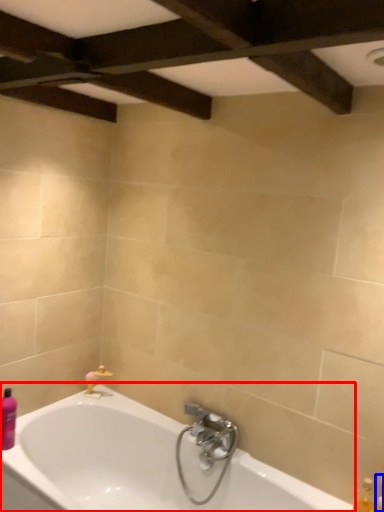
Question: Among these objects, which one is farthest to the camera, bathtub (highlighted by a red box) or toiletry (highlighted by a blue box)?

Choices:
 (A) bathtub
 (B) toiletry

Answer: (B)